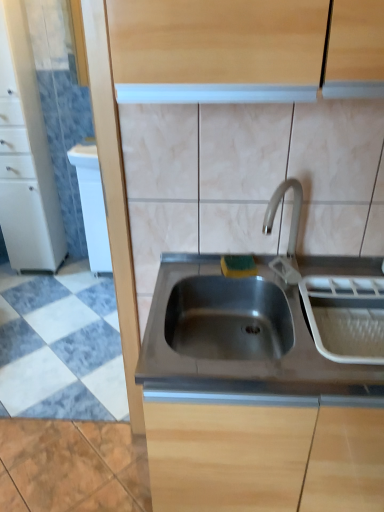
How much space does stainless steel sink at center, positioned as the 2th cabinetry in back-to-front order, occupy vertically?

stainless steel sink at center, positioned as the 2th cabinetry in back-to-front order, is 31.02 inches in height.

This screenshot has height=512, width=384. Describe the element at coordinates (25, 154) in the screenshot. I see `white glossy cabinet at left, marked as the first cabinetry in a left-to-right arrangement` at that location.

The width and height of the screenshot is (384, 512). What do you see at coordinates (266, 327) in the screenshot? I see `stainless steel sink at center` at bounding box center [266, 327].

The width and height of the screenshot is (384, 512). I want to click on white glossy dishwasher at left, so click(x=92, y=205).

From a real-world perspective, is stainless steel sink at center, the first cabinetry positioned from the right, positioned over white marble floor at lower left based on gravity?

Yes, from a real-world perspective, stainless steel sink at center, the first cabinetry positioned from the right, is above white marble floor at lower left.

At what (x,y) coordinates should I click in order to perform the action: click on ceramic tile above the stainless steel sink at center, the second cabinetry from the top (from the image's perspective). Please return your answer as a coordinate pair (x, y). Looking at the image, I should click on (61, 346).

Does stainless steel sink at center, the first cabinetry positioned from the right, appear on the left side of white marble floor at lower left?

No.

Between white glossy dishwasher at left and stainless steel sink at center, placed as the second cabinetry when sorted from left to right, which one has larger width?

Wider between the two is stainless steel sink at center, placed as the second cabinetry when sorted from left to right.

Is white glossy dishwasher at left with stainless steel sink at center, the first cabinetry positioned from the right?

white glossy dishwasher at left is not next to stainless steel sink at center, the first cabinetry positioned from the right, and they're not touching.

Does point (103, 226) come in front of point (286, 489)?

That is False.

Is white glossy dishwasher at left not within stainless steel sink at center, positioned as the 2th cabinetry in back-to-front order?

Yes, white glossy dishwasher at left is outside of stainless steel sink at center, positioned as the 2th cabinetry in back-to-front order.

From a real-world perspective, is white glossy cabinet at left, positioned as the second cabinetry in bottom-to-top order, physically below stainless steel sink at center?

No, from a real-world perspective, white glossy cabinet at left, positioned as the second cabinetry in bottom-to-top order, is not beneath stainless steel sink at center.

How far apart are white glossy cabinet at left, marked as the first cabinetry in a left-to-right arrangement, and stainless steel sink at center?

white glossy cabinet at left, marked as the first cabinetry in a left-to-right arrangement, and stainless steel sink at center are 1.79 meters apart from each other.

Is white glossy cabinet at left, the 1th cabinetry positioned from the back, positioned far away from stainless steel sink at center?

Yes.

What's the angular difference between white glossy cabinet at left, marked as the first cabinetry in a left-to-right arrangement, and stainless steel sink at center's facing directions?

They differ by 0.818 degrees in their facing directions.

From a real-world perspective, is white marble floor at lower left positioned above or below stainless steel sink at center, positioned as the 2th cabinetry in back-to-front order?

white marble floor at lower left is situated lower than stainless steel sink at center, positioned as the 2th cabinetry in back-to-front order, in the real world.

Can you confirm if white marble floor at lower left is wider than stainless steel sink at center, which is the first cabinetry in bottom-to-top order?

Yes, white marble floor at lower left is wider than stainless steel sink at center, which is the first cabinetry in bottom-to-top order.

Based on the photo, is white marble floor at lower left located outside stainless steel sink at center, the second cabinetry from the top?

That's correct, white marble floor at lower left is outside of stainless steel sink at center, the second cabinetry from the top.

Which is closer to the camera, [84,389] or [152,393]?

The point [152,393] is closer to the camera.

Could you measure the distance between stainless steel sink at center, positioned as the 2th cabinetry in back-to-front order, and white glossy cabinet at left, the 1th cabinetry positioned from the back?

stainless steel sink at center, positioned as the 2th cabinetry in back-to-front order, and white glossy cabinet at left, the 1th cabinetry positioned from the back, are 6.82 feet apart.

Between point (265, 408) and point (38, 118), which one is positioned in front?

The point (265, 408) is closer.

Between stainless steel sink at center, the second cabinetry from the top, and white glossy cabinet at left, marked as the first cabinetry in a left-to-right arrangement, which one has larger width?

With larger width is stainless steel sink at center, the second cabinetry from the top.

Image resolution: width=384 pixels, height=512 pixels. I want to click on cabinetry located on the left of stainless steel sink at center, which is the first cabinetry in bottom-to-top order, so click(25, 154).

Is white plastic dish rack at right located outside stainless steel sink at center?

That's incorrect, white plastic dish rack at right is not completely outside stainless steel sink at center.

Where is `appliance above the stainless steel sink at center (from the image's perspective)`? This screenshot has width=384, height=512. appliance above the stainless steel sink at center (from the image's perspective) is located at coordinates (346, 317).

How different are the orientations of stainless steel sink at center, which is the first cabinetry in bottom-to-top order, and white plastic dish rack at right in degrees?

stainless steel sink at center, which is the first cabinetry in bottom-to-top order, and white plastic dish rack at right are facing 0.32 degrees away from each other.

Is stainless steel sink at center, positioned as the 2th cabinetry in back-to-front order, positioned with its back to white plastic dish rack at right?

stainless steel sink at center, positioned as the 2th cabinetry in back-to-front order, is not turned away from white plastic dish rack at right.

Which is in front, point (238, 506) or point (371, 326)?

The point (238, 506) is closer to the camera.

This screenshot has height=512, width=384. What are the coordinates of `ceramic tile below the stainless steel sink at center, the second cabinetry from the top (from a real-world perspective)` in the screenshot? It's located at (61, 346).

Find the location of a particular element. This screenshot has width=384, height=512. dish washer above the stainless steel sink at center, placed as the second cabinetry when sorted from left to right (from a real-world perspective) is located at coordinates (92, 205).

Considering their positions, is white glossy cabinet at left, positioned as the second cabinetry in bottom-to-top order, positioned closer to stainless steel sink at center, positioned as the 2th cabinetry in back-to-front order, than white plastic dish rack at right?

white plastic dish rack at right.

From the image, which object appears to be nearer to stainless steel sink at center, the second cabinetry from the top, white marble floor at lower left or white glossy cabinet at left, the 1th cabinetry positioned from the back?

white marble floor at lower left is closer to stainless steel sink at center, the second cabinetry from the top.

Looking at the image, which one is located further to white marble floor at lower left, white glossy dishwasher at left or white glossy cabinet at left, marked as the first cabinetry in a left-to-right arrangement?

white glossy cabinet at left, marked as the first cabinetry in a left-to-right arrangement, is positioned further to the anchor white marble floor at lower left.

From the image, which object appears to be farther from stainless steel sink at center, white plastic dish rack at right or white marble floor at lower left?

white marble floor at lower left.

Based on their spatial positions, is white marble floor at lower left or stainless steel sink at center, the first cabinetry positioned from the right, further from white plastic dish rack at right?

Based on the image, white marble floor at lower left appears to be further to white plastic dish rack at right.

Looking at the image, which one is located closer to white glossy dishwasher at left, white glossy cabinet at left, marked as the first cabinetry in a left-to-right arrangement, or white marble floor at lower left?

white glossy cabinet at left, marked as the first cabinetry in a left-to-right arrangement, is positioned closer to the anchor white glossy dishwasher at left.

Estimate the real-world distances between objects in this image. Which object is closer to white plastic dish rack at right, stainless steel sink at center, placed as the second cabinetry when sorted from left to right, or white marble floor at lower left?

Based on the image, stainless steel sink at center, placed as the second cabinetry when sorted from left to right, appears to be nearer to white plastic dish rack at right.

When comparing their distances from white glossy dishwasher at left, does white marble floor at lower left or white plastic dish rack at right seem closer?

Among the two, white marble floor at lower left is located nearer to white glossy dishwasher at left.

At what (x,y) coordinates should I click in order to perform the action: click on sink between white glossy cabinet at left, acting as the 2th cabinetry starting from the right, and white plastic dish rack at right from left to right. Please return your answer as a coordinate pair (x, y). This screenshot has width=384, height=512. Looking at the image, I should click on (266, 327).

The height and width of the screenshot is (512, 384). I want to click on ceramic tile situated between white glossy cabinet at left, the 1th cabinetry positioned from the back, and white plastic dish rack at right from left to right, so click(61, 346).

In order to click on sink situated between white glossy cabinet at left, the 1th cabinetry positioned from the back, and stainless steel sink at center, placed as the second cabinetry when sorted from left to right, from left to right in this screenshot , I will do `click(266, 327)`.

The width and height of the screenshot is (384, 512). Identify the location of sink between white marble floor at lower left and stainless steel sink at center, the second cabinetry from the top, from left to right. (266, 327).